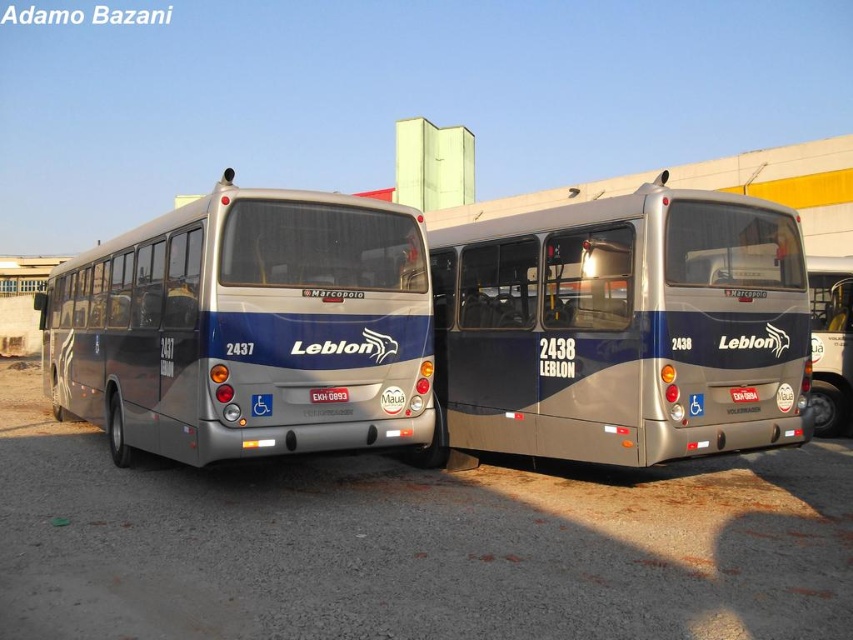
Question: Considering the real-world distances, which object is farthest from the silver metallic bus at center?

Choices:
 (A) silver metallic bus at left
 (B) metallic silver bus at center

Answer: (A)

Question: Does silver metallic bus at left have a lesser width compared to silver metallic bus at center?

Choices:
 (A) no
 (B) yes

Answer: (A)

Question: Which object is farther from the camera taking this photo?

Choices:
 (A) silver metallic bus at center
 (B) silver metallic bus at left
 (C) metallic silver bus at center

Answer: (A)

Question: Is metallic silver bus at center below silver metallic bus at center?

Choices:
 (A) yes
 (B) no

Answer: (B)

Question: Can you confirm if metallic silver bus at center is thinner than silver metallic bus at center?

Choices:
 (A) no
 (B) yes

Answer: (A)

Question: Which point is farther to the camera?

Choices:
 (A) metallic silver bus at center
 (B) silver metallic bus at left
 (C) silver metallic bus at center

Answer: (C)